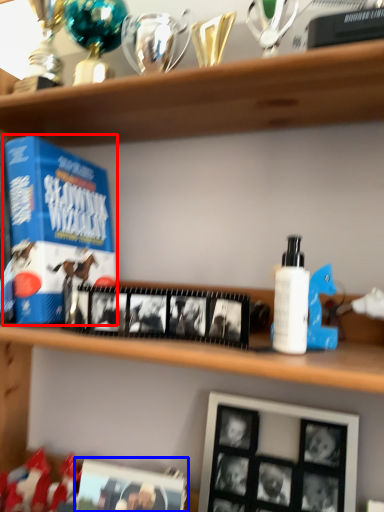
Question: Which point is closer to the camera, product (highlighted by a red box) or picture frame (highlighted by a blue box)?

Choices:
 (A) product
 (B) picture frame

Answer: (B)